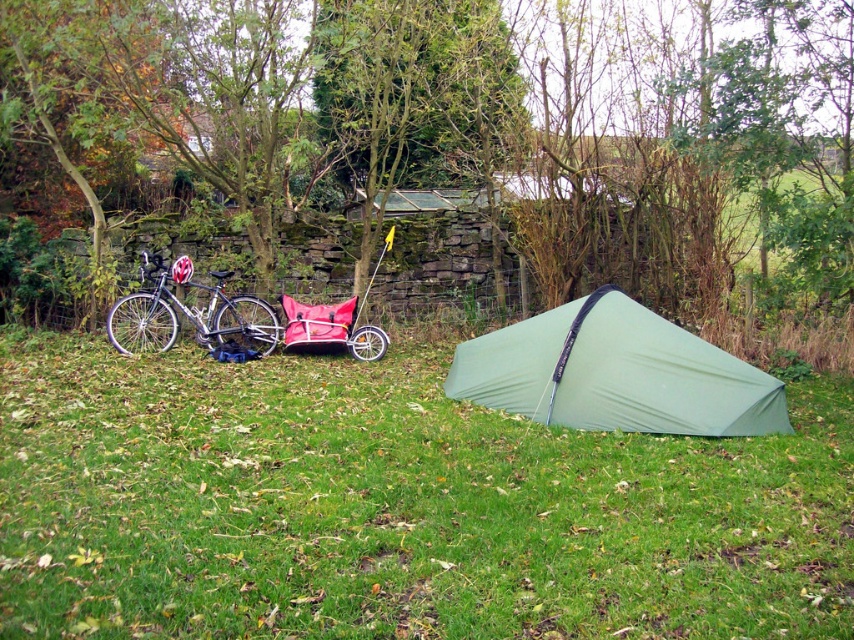
Can you confirm if green fabric tent at center is positioned above red fabric baby carriage at center?

Incorrect, green fabric tent at center is not positioned above red fabric baby carriage at center.

Is green fabric tent at center to the left of red fabric baby carriage at center from the viewer's perspective?

In fact, green fabric tent at center is to the right of red fabric baby carriage at center.

Where is `green fabric tent at center`? green fabric tent at center is located at coordinates (615, 372).

The image size is (854, 640). I want to click on green fabric tent at center, so click(615, 372).

Describe the element at coordinates (395, 506) in the screenshot. I see `green grassy at center` at that location.

Is point (173, 419) in front of point (501, 392)?

That is True.

Find the location of `green grassy at center`. green grassy at center is located at coordinates (395, 506).

Measure the distance from shiny silver bicycle at left to red fabric baby carriage at center.

shiny silver bicycle at left and red fabric baby carriage at center are 97.96 centimeters apart.

Who is lower down, shiny silver bicycle at left or red fabric baby carriage at center?

red fabric baby carriage at center is lower down.

Does point (208, 312) come in front of point (287, 305)?

Yes, point (208, 312) is in front of point (287, 305).

At what (x,y) coordinates should I click in order to perform the action: click on shiny silver bicycle at left. Please return your answer as a coordinate pair (x, y). The image size is (854, 640). Looking at the image, I should click on (188, 314).